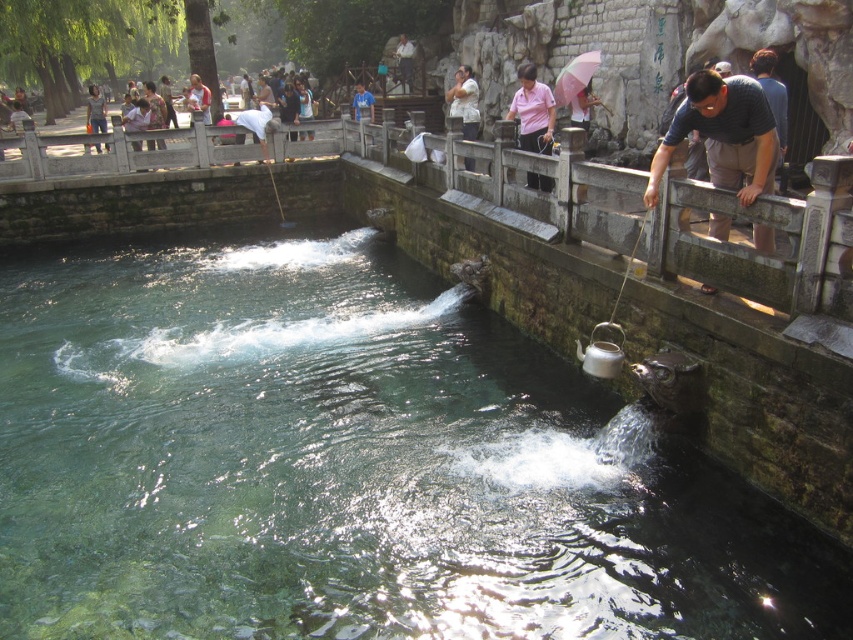
Question: Can you confirm if dark blue shirt at upper right is wider than blue shirt at center?

Choices:
 (A) no
 (B) yes

Answer: (B)

Question: Is pink cotton shirt at center closer to the viewer compared to white cotton shirt at center?

Choices:
 (A) yes
 (B) no

Answer: (A)

Question: Which point appears farthest from the camera in this image?

Choices:
 (A) (401, 68)
 (B) (194, 90)

Answer: (A)

Question: Which point is farther to the camera?

Choices:
 (A) clear glass water at center
 (B) stone railing at right

Answer: (B)

Question: Which of the following is the closest to the observer?

Choices:
 (A) white cotton shirt at upper center
 (B) pink cotton shirt at center
 (C) light brown fabric shirt at upper center

Answer: (B)

Question: Is stone railing at right below light brown leather jacket at upper left?

Choices:
 (A) no
 (B) yes

Answer: (B)